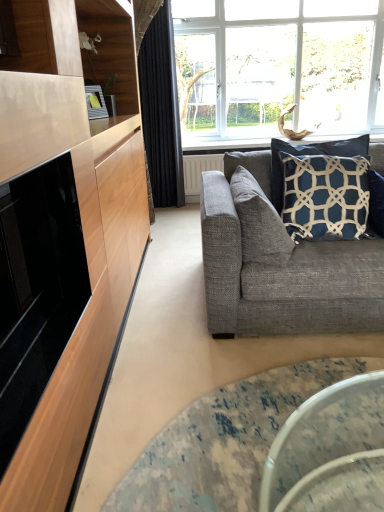
Question: Is translucent glass coffee table at lower center taller than navy blue fabric pillow at upper right, the second pillow from the left?

Choices:
 (A) yes
 (B) no

Answer: (B)

Question: Is translucent glass coffee table at lower center surrounding navy blue fabric pillow at upper right, arranged as the 1th pillow when viewed from the right?

Choices:
 (A) yes
 (B) no

Answer: (B)

Question: Is the depth of translucent glass coffee table at lower center less than that of navy blue fabric pillow at upper right, the second pillow from the left?

Choices:
 (A) yes
 (B) no

Answer: (A)

Question: Does translucent glass coffee table at lower center have a smaller size compared to navy blue fabric pillow at upper right, arranged as the 1th pillow when viewed from the right?

Choices:
 (A) yes
 (B) no

Answer: (A)

Question: From the image's perspective, is translucent glass coffee table at lower center beneath navy blue fabric pillow at upper right, the second pillow from the left?

Choices:
 (A) no
 (B) yes

Answer: (B)

Question: Is translucent glass coffee table at lower center with navy blue fabric pillow at upper right, the second pillow from the left?

Choices:
 (A) yes
 (B) no

Answer: (B)

Question: Does navy blue fabric pillow at upper right, arranged as the 1th pillow when viewed from the right, have a greater width compared to translucent glass coffee table at lower center?

Choices:
 (A) no
 (B) yes

Answer: (A)

Question: From the image's perspective, is navy blue fabric pillow at upper right, arranged as the 1th pillow when viewed from the right, below translucent glass coffee table at lower center?

Choices:
 (A) no
 (B) yes

Answer: (A)

Question: Does navy blue fabric pillow at upper right, the second pillow from the left, come behind translucent glass coffee table at lower center?

Choices:
 (A) yes
 (B) no

Answer: (A)

Question: Considering the relative positions of navy blue fabric pillow at upper right, arranged as the 1th pillow when viewed from the right, and translucent glass coffee table at lower center in the image provided, is navy blue fabric pillow at upper right, arranged as the 1th pillow when viewed from the right, in front of translucent glass coffee table at lower center?

Choices:
 (A) no
 (B) yes

Answer: (A)

Question: Is navy blue fabric pillow at upper right, the second pillow from the left, next to translucent glass coffee table at lower center and touching it?

Choices:
 (A) yes
 (B) no

Answer: (B)

Question: Is navy blue fabric pillow at upper right, the second pillow from the left, at the left side of translucent glass coffee table at lower center?

Choices:
 (A) yes
 (B) no

Answer: (B)

Question: Is textured gray couch at right with black velvet curtain at upper center?

Choices:
 (A) yes
 (B) no

Answer: (B)